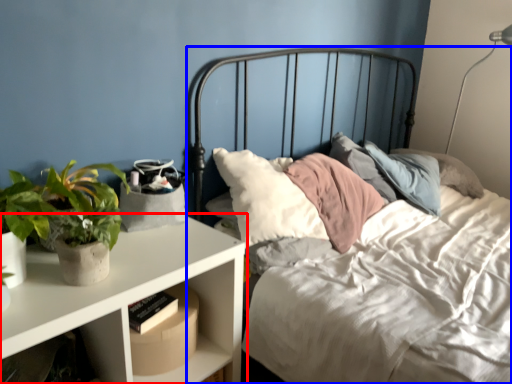
Question: Which object is closer to the camera taking this photo, nightstand (highlighted by a red box) or bed (highlighted by a blue box)?

Choices:
 (A) nightstand
 (B) bed

Answer: (B)